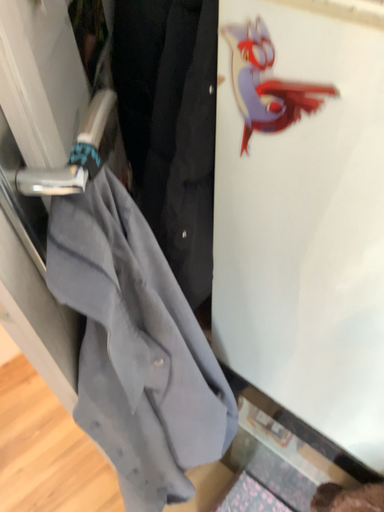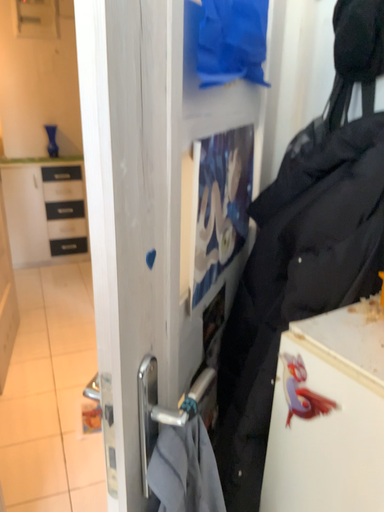
Question: How did the camera likely rotate when shooting the video?

Choices:
 (A) rotated upward
 (B) rotated downward

Answer: (A)